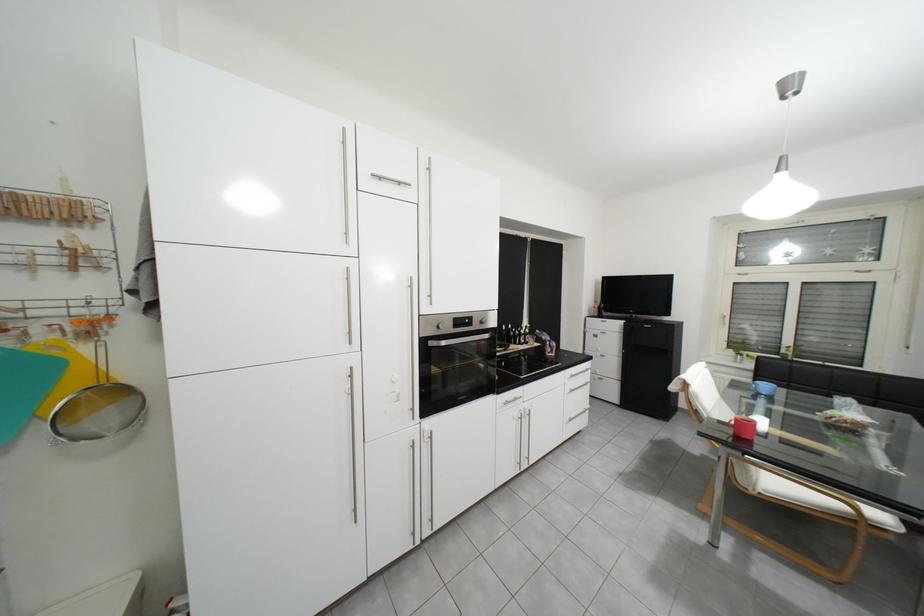
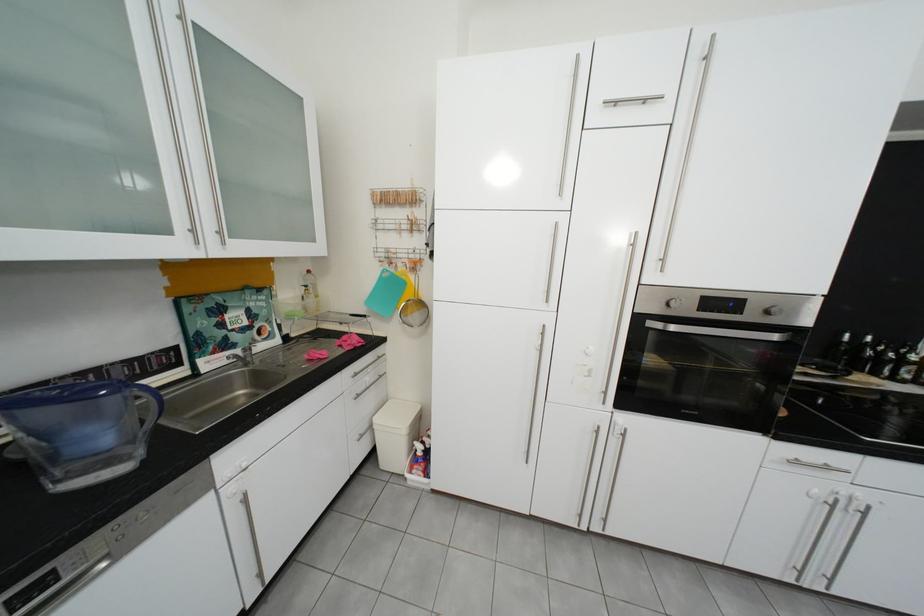
Find the pixel in the second image that matches (x=450, y=329) in the first image.

(679, 306)